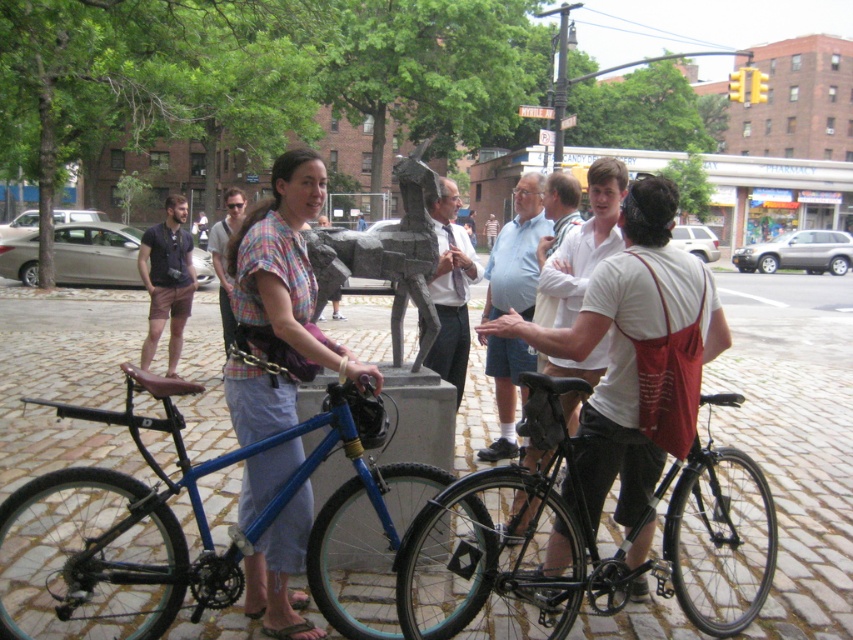
Can you confirm if plaid fabric shirt at center is positioned below light blue shirt at center?

Indeed, plaid fabric shirt at center is positioned under light blue shirt at center.

Between plaid fabric shirt at center and light blue shirt at center, which one has more height?

plaid fabric shirt at center is taller.

Who is more forward, (267,282) or (444,193)?

Point (267,282)

Identify the location of plaid fabric shirt at center. This screenshot has height=640, width=853. (285, 275).

Is point (317, 548) positioned after point (505, 432)?

No.

Who is taller, blue matte bicycle at center or light blue cotton shirt at center?

light blue cotton shirt at center is taller.

Is point (136, 433) more distant than point (498, 292)?

That is False.

Image resolution: width=853 pixels, height=640 pixels. In order to click on blue matte bicycle at center in this screenshot , I will do `click(199, 529)`.

Is white cotton shirt at center above light blue cotton shirt at center?

No, white cotton shirt at center is not above light blue cotton shirt at center.

Who is lower down, white cotton shirt at center or light blue cotton shirt at center?

white cotton shirt at center is below.

Is point (612, 452) positioned after point (531, 198)?

No.

In order to click on white cotton shirt at center in this screenshot , I will do `click(636, 352)`.